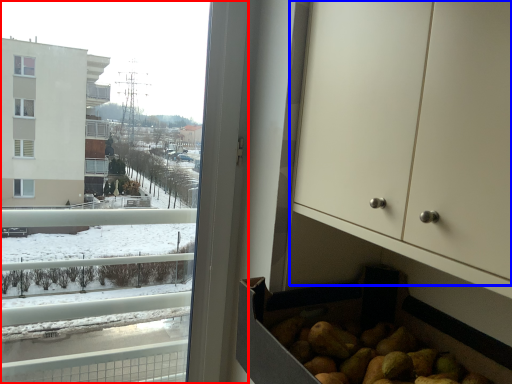
Question: Among these objects, which one is nearest to the camera, window (highlighted by a red box) or dresser (highlighted by a blue box)?

Choices:
 (A) window
 (B) dresser

Answer: (B)